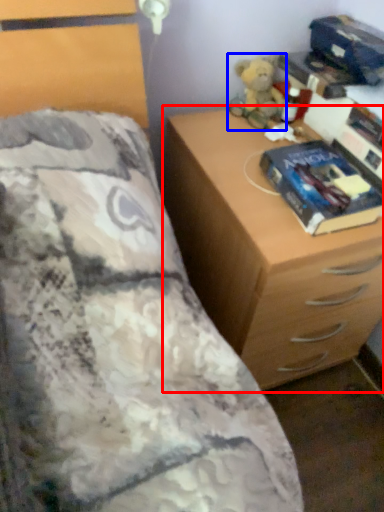
Question: Which of the following is the closest to the observer, chest of drawers (highlighted by a red box) or toy (highlighted by a blue box)?

Choices:
 (A) chest of drawers
 (B) toy

Answer: (A)